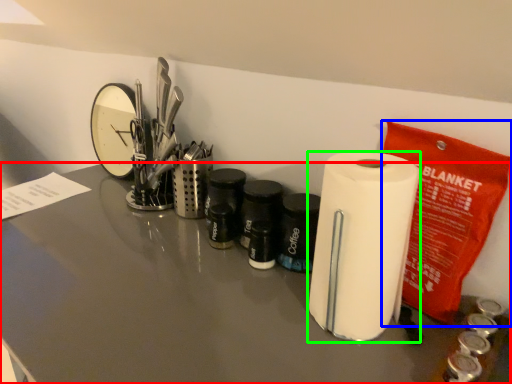
Question: Considering the real-world distances, which object is closest to counter top (highlighted by a red box)? stationery (highlighted by a blue box) or paper towel (highlighted by a green box).

Choices:
 (A) stationery
 (B) paper towel

Answer: (B)